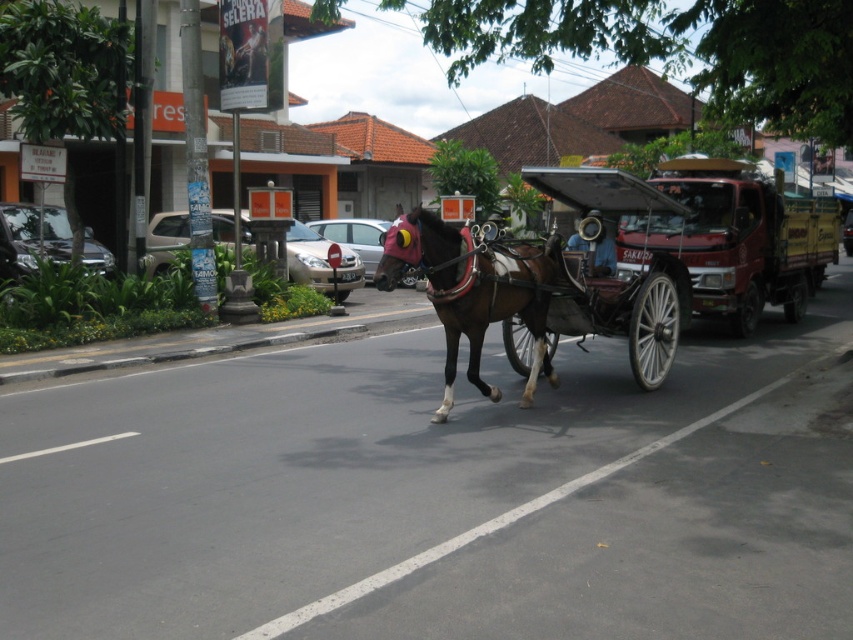
Question: Which point appears farthest from the camera in this image?

Choices:
 (A) (463, 291)
 (B) (782, 282)
 (C) (668, 371)

Answer: (B)

Question: Is metallic red horse cart at center to the right of brown glossy horse at center from the viewer's perspective?

Choices:
 (A) no
 (B) yes

Answer: (B)

Question: Which point is closer to the camera?

Choices:
 (A) wooden cart at center
 (B) brown glossy horse at center

Answer: (B)

Question: In this image, where is metallic red horse cart at center located relative to brown glossy horse at center?

Choices:
 (A) left
 (B) right

Answer: (B)

Question: Does metallic red horse cart at center have a larger size compared to wooden cart at center?

Choices:
 (A) yes
 (B) no

Answer: (B)

Question: Based on their relative distances, which object is farther from the brown glossy horse at center?

Choices:
 (A) metallic red horse cart at center
 (B) wooden cart at center

Answer: (A)